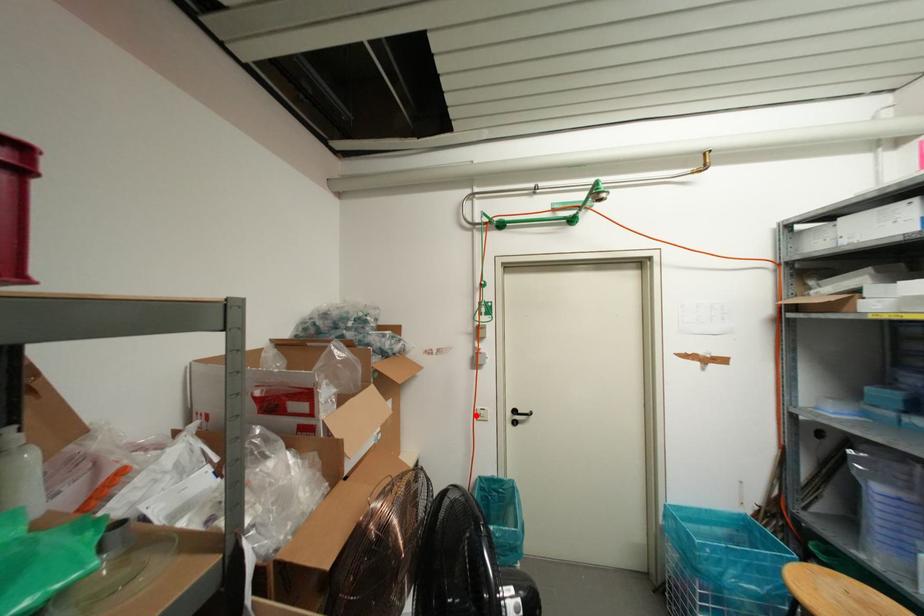
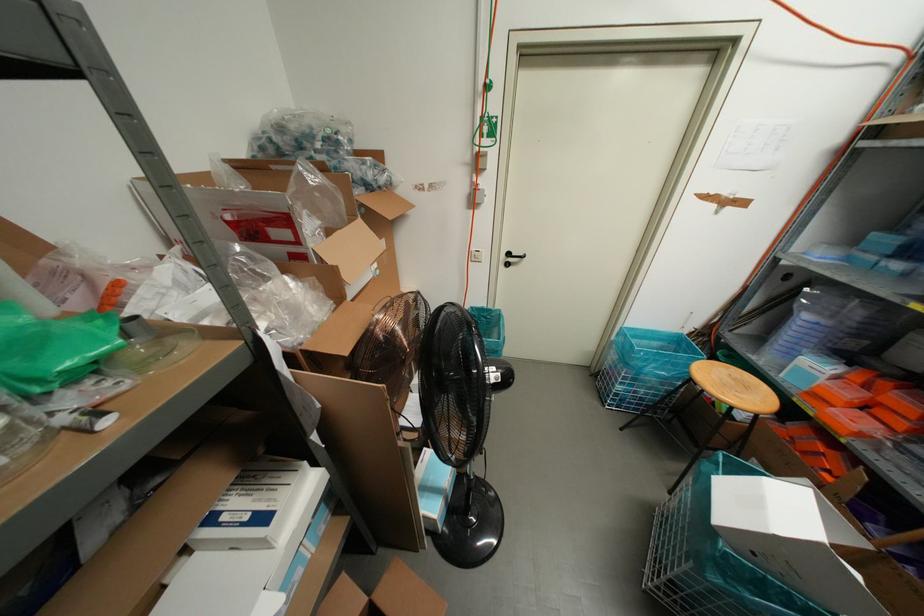
Question: I am providing you with two images of the same scene from different viewpoints. Given a red point in image1, look at the same physical point in image2. Is it:

Choices:
 (A) Closer to the viewpoint
 (B) Farther from the viewpoint

Answer: (A)